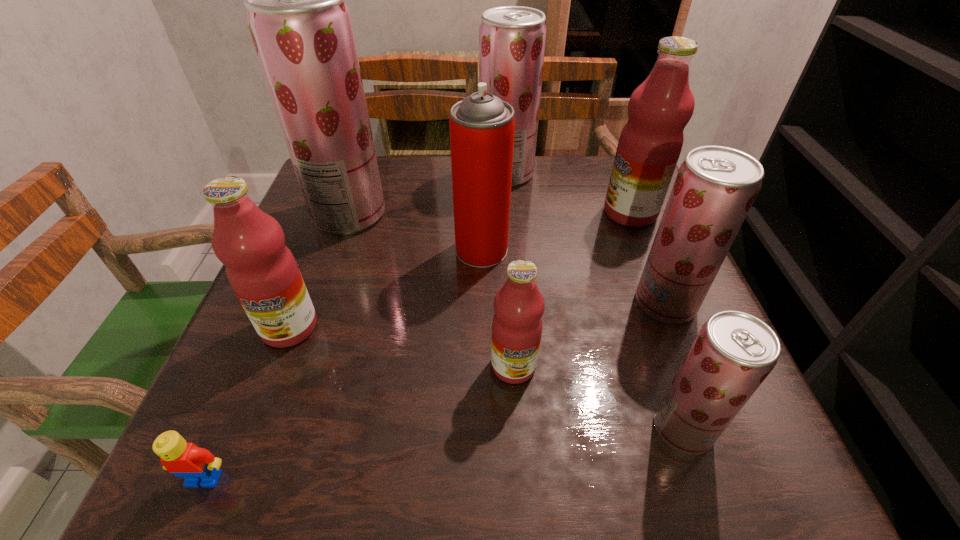
Identify which strawberry fruit juice is the second closest to the second nearest object. Please provide its 2D coordinates. Your answer should be formatted as a tuple, i.e. [(x, y)], where the tuple contains the x and y coordinates of a point satisfying the conditions above.

[(512, 39)]

The image size is (960, 540). In order to click on strawberry fruit juice that is the second closest one to the red Lego in this screenshot , I will do `click(733, 353)`.

Where is `pink fruit juice that can be found as the closest to the second smallest pink fruit juice`? pink fruit juice that can be found as the closest to the second smallest pink fruit juice is located at coordinates (519, 305).

You are a GUI agent. You are given a task and a screenshot of the screen. Output one action in this format:
    pyautogui.click(x=<x>, y=<y>)
    Task: Click on the pink fruit juice identified as the closest to the third nearest strawberry fruit juice
    
    Given the screenshot: What is the action you would take?
    pyautogui.click(x=262, y=271)

Locate an element on the screen. Image resolution: width=960 pixels, height=540 pixels. vacant region that satisfies the following two spatial constraints: 1. on the label of the biggest pink fruit juice; 2. on the label of the second biggest pink fruit juice is located at coordinates (676, 327).

At what (x,y) coordinates should I click in order to perform the action: click on free point that satisfies the following two spatial constraints: 1. on the label of the second smallest pink fruit juice; 2. on the right side of the smallest strawberry fruit juice. Please return your answer as a coordinate pair (x, y). The image size is (960, 540). Looking at the image, I should click on (251, 429).